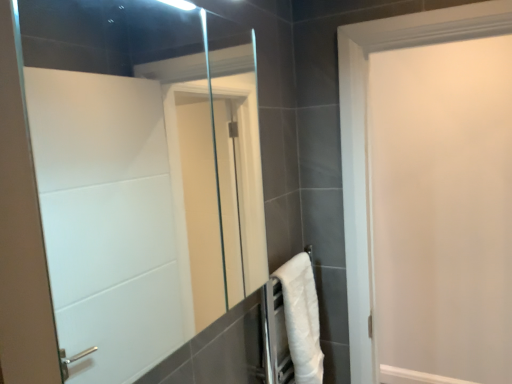
Question: Is white matte door at upper right surrounded by clear glass mirror at center?

Choices:
 (A) yes
 (B) no

Answer: (B)

Question: Does clear glass mirror at center have a greater width compared to white matte door at upper right?

Choices:
 (A) no
 (B) yes

Answer: (B)

Question: Considering the relative positions of clear glass mirror at center and white matte door at upper right in the image provided, is clear glass mirror at center to the right of white matte door at upper right from the viewer's perspective?

Choices:
 (A) no
 (B) yes

Answer: (A)

Question: Does clear glass mirror at center have a smaller size compared to white matte door at upper right?

Choices:
 (A) yes
 (B) no

Answer: (A)

Question: Considering the relative sizes of clear glass mirror at center and white matte door at upper right in the image provided, is clear glass mirror at center taller than white matte door at upper right?

Choices:
 (A) no
 (B) yes

Answer: (A)

Question: From a real-world perspective, relative to white matte door at upper right, is clear glass mirror at center vertically above or below?

Choices:
 (A) below
 (B) above

Answer: (B)

Question: In the image, is clear glass mirror at center on the left side or the right side of white matte door at upper right?

Choices:
 (A) right
 (B) left

Answer: (B)

Question: In terms of height, does clear glass mirror at center look taller or shorter compared to white matte door at upper right?

Choices:
 (A) short
 (B) tall

Answer: (A)

Question: Looking at their shapes, would you say clear glass mirror at center is wider or thinner than white matte door at upper right?

Choices:
 (A) wide
 (B) thin

Answer: (A)

Question: In the image, is white soft towel at lower right on the left side or the right side of clear glass mirror at center?

Choices:
 (A) left
 (B) right

Answer: (B)

Question: From a real-world perspective, relative to clear glass mirror at center, is white soft towel at lower right vertically above or below?

Choices:
 (A) above
 (B) below

Answer: (B)

Question: Which is correct: white soft towel at lower right is inside clear glass mirror at center, or outside of it?

Choices:
 (A) outside
 (B) inside

Answer: (A)

Question: Considering the positions of white soft towel at lower right and clear glass mirror at center in the image, is white soft towel at lower right taller or shorter than clear glass mirror at center?

Choices:
 (A) short
 (B) tall

Answer: (A)

Question: Is point (479, 248) closer or farther from the camera than point (221, 198)?

Choices:
 (A) closer
 (B) farther

Answer: (A)

Question: From a real-world perspective, relative to clear glass mirror at center, is white matte door at upper right vertically above or below?

Choices:
 (A) above
 (B) below

Answer: (B)